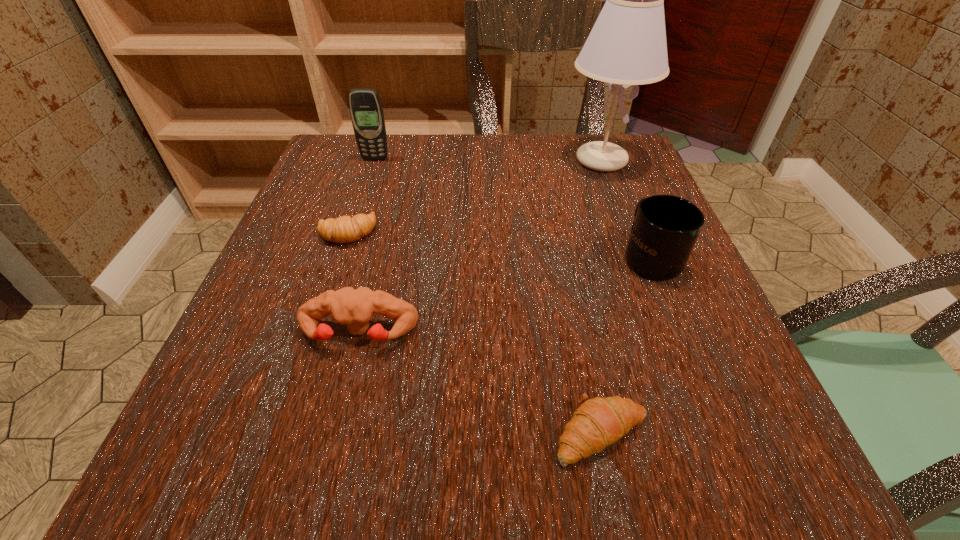
Identify the location of vacant area at the left edge of the desktop. (331, 357).

What are the coordinates of `free space at the right edge of the desktop` in the screenshot? It's located at (618, 306).

In order to click on vacant space at the far left corner of the desktop in this screenshot , I will do `click(338, 148)`.

In the image, there is a desktop. Identify the location of free space at the far right corner. (582, 187).

You are a GUI agent. You are given a task and a screenshot of the screen. Output one action in this format:
    pyautogui.click(x=<x>, y=<y>)
    Task: Click on the unoccupied area between the mug and the puncher
    
    Given the screenshot: What is the action you would take?
    pyautogui.click(x=505, y=294)

The height and width of the screenshot is (540, 960). What are the coordinates of `free area in between the cellular telephone and the puncher` in the screenshot? It's located at (367, 246).

You are a GUI agent. You are given a task and a screenshot of the screen. Output one action in this format:
    pyautogui.click(x=<x>, y=<y>)
    Task: Click on the free space between the nearest object and the third shortest object
    The height and width of the screenshot is (540, 960).
    Given the screenshot: What is the action you would take?
    pyautogui.click(x=480, y=383)

Where is `free space between the second nearest object and the nearest object`? This screenshot has height=540, width=960. free space between the second nearest object and the nearest object is located at coordinates (480, 383).

Identify the location of empty space between the fifth farthest object and the cellular telephone. The width and height of the screenshot is (960, 540). (367, 246).

This screenshot has width=960, height=540. What are the coordinates of `unoccupied position between the second nearest object and the fifth shortest object` in the screenshot? It's located at (367, 246).